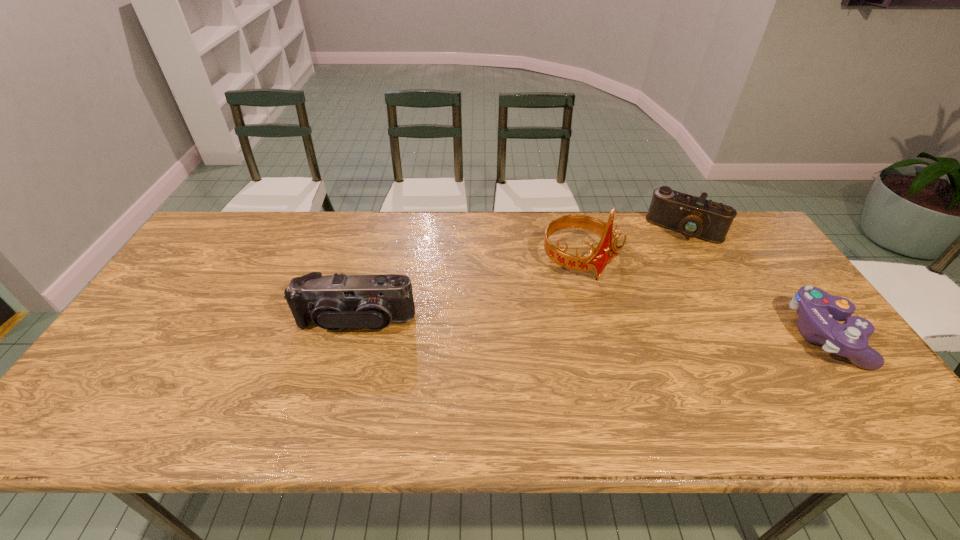
At what (x,y) coordinates should I click in order to perform the action: click on the leftmost object. Please return your answer as a coordinate pair (x, y). Looking at the image, I should click on (332, 302).

Locate an element on the screen. The image size is (960, 540). the third shortest object is located at coordinates (332, 302).

Locate an element on the screen. The image size is (960, 540). the rightmost object is located at coordinates (817, 310).

Identify the location of the shortest object. The height and width of the screenshot is (540, 960). pyautogui.click(x=817, y=310).

At what (x,y) coordinates should I click in order to perform the action: click on the second object from left to right. Please return your answer as a coordinate pair (x, y). Looking at the image, I should click on (597, 259).

Identify the location of the tallest object. The height and width of the screenshot is (540, 960). (597, 259).

Locate an element on the screen. This screenshot has width=960, height=540. the third object from left to right is located at coordinates (694, 217).

Locate an element on the screen. The height and width of the screenshot is (540, 960). the third tallest object is located at coordinates (694, 217).

Identify the location of free space located on the front-facing side of the leftmost object. (340, 381).

You are a GUI agent. You are given a task and a screenshot of the screen. Output one action in this format:
    pyautogui.click(x=<x>, y=<y>)
    Task: Click on the free space located on the back of the control
    This screenshot has height=540, width=960.
    Given the screenshot: What is the action you would take?
    pyautogui.click(x=752, y=237)